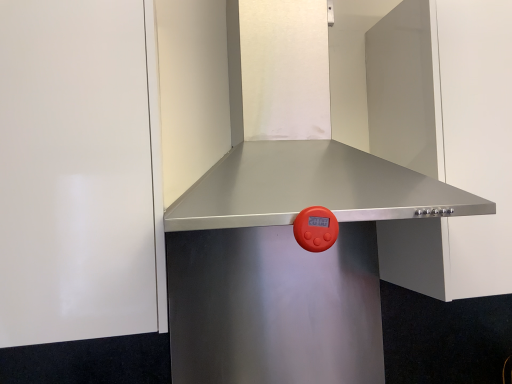
Question: In terms of width, does stainless steel vent at center look wider or thinner when compared to stainless steel range hood at upper center, placed as the second door when sorted from left to right?

Choices:
 (A) thin
 (B) wide

Answer: (B)

Question: Considering the positions of point (414, 188) and point (481, 183), is point (414, 188) closer or farther from the camera than point (481, 183)?

Choices:
 (A) closer
 (B) farther

Answer: (A)

Question: Estimate the real-world distances between objects in this image. Which object is closer to the stainless steel range hood at upper center, placed as the second door when sorted from left to right?

Choices:
 (A) white glossy door at upper left, which appears as the 1th door when viewed from the left
 (B) stainless steel vent at center

Answer: (B)

Question: Which is nearer to the stainless steel vent at center?

Choices:
 (A) stainless steel range hood at upper center, placed as the second door when sorted from left to right
 (B) white glossy door at upper left, the second door in the right-to-left sequence

Answer: (A)